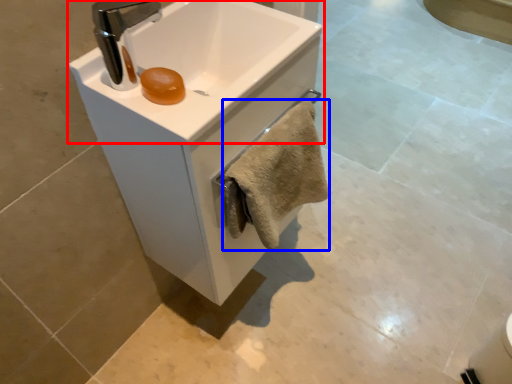
Question: Which of the following is the farthest to the observer, sink (highlighted by a red box) or bath towel (highlighted by a blue box)?

Choices:
 (A) sink
 (B) bath towel

Answer: (B)